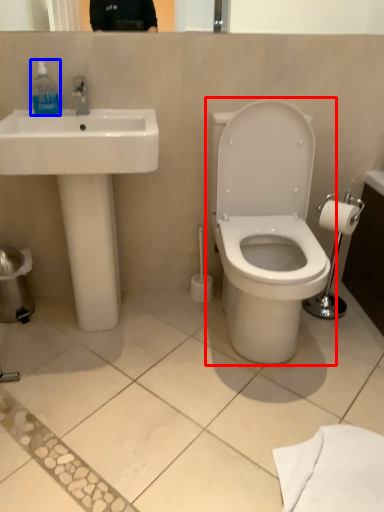
Question: Which of the following is the farthest to the observer, toilet (highlighted by a red box) or toiletry (highlighted by a blue box)?

Choices:
 (A) toilet
 (B) toiletry

Answer: (B)